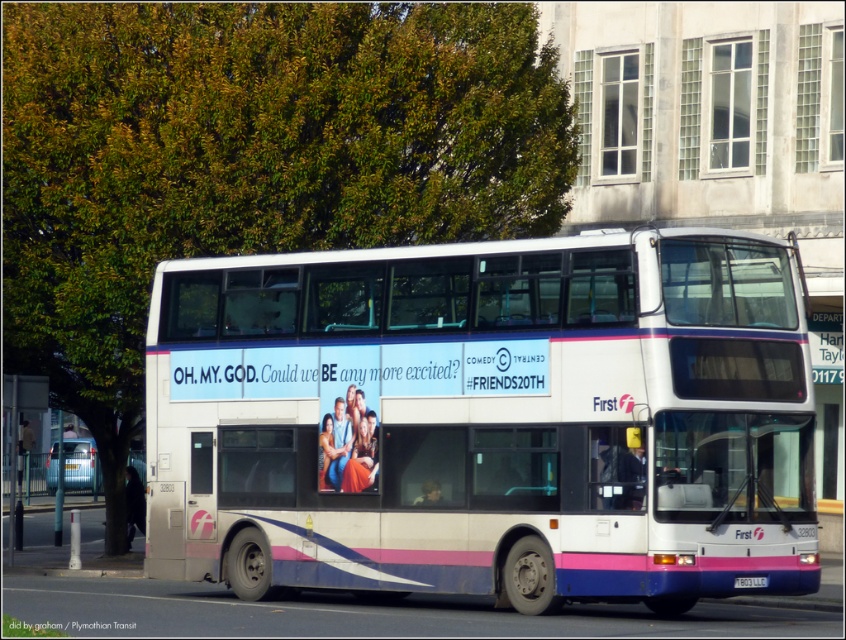
Which is more to the left, white matte/decked bus at center or white plastic license plate at center?

white matte/decked bus at center

Does point (353, 298) come farther from viewer compared to point (755, 582)?

Yes.

I want to click on white matte/decked bus at center, so click(486, 419).